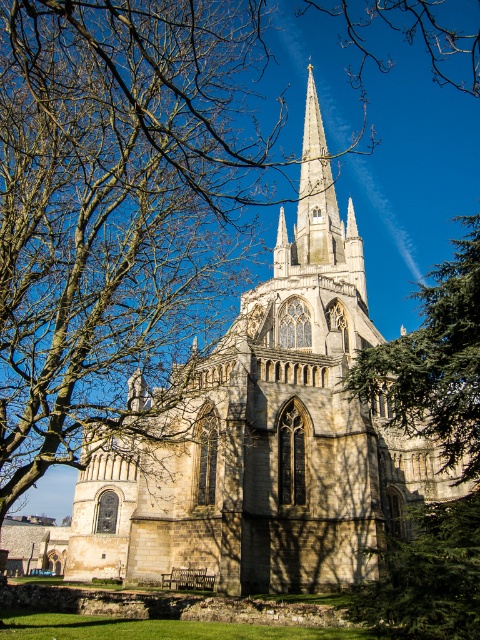
You are standing in front of the cathedral and looking at the two points marked in the image. Which point, point [177,410] or point [298,241], is closer to your eyes?

Point [177,410] is closer to the camera than point [298,241], so the point closer to your eyes is point [177,410].

You are standing in front of the cathedral and want to take a photo that includes both the green leafy tree at right and the pointed spire of the cathedral. Based on their positions, will the tree appear to the left or right of the spire in the photo?

The green leafy tree at right is located at point (434, 362), which means it is positioned to the right side of the image. Since the pointed spire is centered and rises prominently, the tree will appear to the right of the spire in the photo.

You are standing in front of the cathedral and notice a point marked at coordinates (434, 362). Based on the scene description, which object does this point correspond to?

The point at (434, 362) corresponds to the green leafy tree at right.